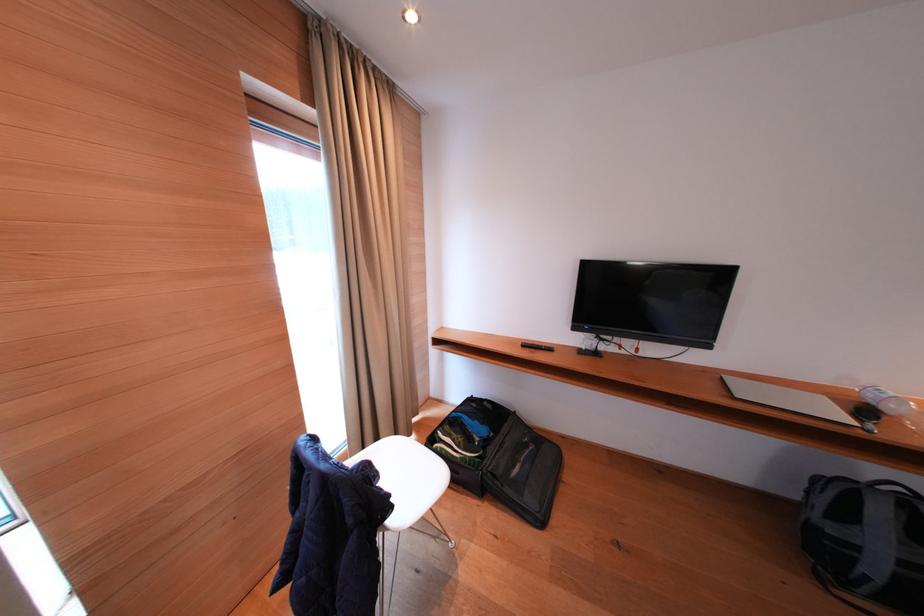
The height and width of the screenshot is (616, 924). I want to click on suitcase handle, so click(456, 472).